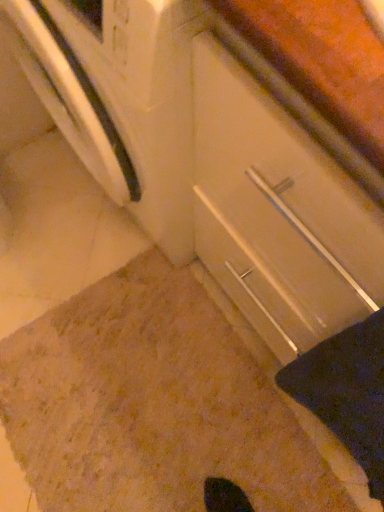
Question: Can you confirm if white glossy drawer at center is shorter than black fabric at lower right?

Choices:
 (A) no
 (B) yes

Answer: (A)

Question: From the image's perspective, is white glossy drawer at center below black fabric at lower right?

Choices:
 (A) yes
 (B) no

Answer: (B)

Question: Does white glossy drawer at center have a greater width compared to black fabric at lower right?

Choices:
 (A) no
 (B) yes

Answer: (B)

Question: Is white glossy drawer at center oriented away from black fabric at lower right?

Choices:
 (A) yes
 (B) no

Answer: (B)

Question: From a real-world perspective, does white glossy drawer at center stand above black fabric at lower right?

Choices:
 (A) no
 (B) yes

Answer: (A)

Question: In the image, is white glossy drawer at center positioned in front of or behind brown textured carpet at lower center?

Choices:
 (A) front
 (B) behind

Answer: (A)

Question: Based on their sizes in the image, would you say white glossy drawer at center is bigger or smaller than brown textured carpet at lower center?

Choices:
 (A) small
 (B) big

Answer: (B)

Question: Is white glossy drawer at center to the left or to the right of brown textured carpet at lower center in the image?

Choices:
 (A) right
 (B) left

Answer: (A)

Question: Is white glossy drawer at center wider or thinner than brown textured carpet at lower center?

Choices:
 (A) wide
 (B) thin

Answer: (B)

Question: Is brown textured carpet at lower center bigger or smaller than white glossy drawer at center?

Choices:
 (A) big
 (B) small

Answer: (B)

Question: Relative to white glossy drawer at center, is brown textured carpet at lower center in front or behind?

Choices:
 (A) front
 (B) behind

Answer: (B)

Question: From the image's perspective, relative to white glossy drawer at center, is brown textured carpet at lower center above or below?

Choices:
 (A) above
 (B) below

Answer: (B)

Question: Is brown textured carpet at lower center wider or thinner than white glossy drawer at center?

Choices:
 (A) thin
 (B) wide

Answer: (B)

Question: In the image, is black fabric at lower right positioned in front of or behind brown textured carpet at lower center?

Choices:
 (A) front
 (B) behind

Answer: (A)

Question: Is black fabric at lower right situated inside brown textured carpet at lower center or outside?

Choices:
 (A) inside
 (B) outside

Answer: (B)